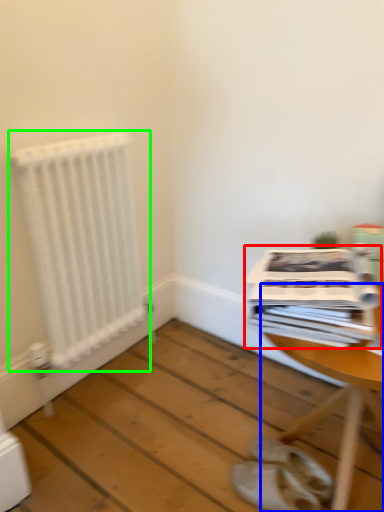
Question: Which is nearer to the magazine (highlighted by a red box)? table (highlighted by a blue box) or radiator (highlighted by a green box).

Choices:
 (A) table
 (B) radiator

Answer: (A)